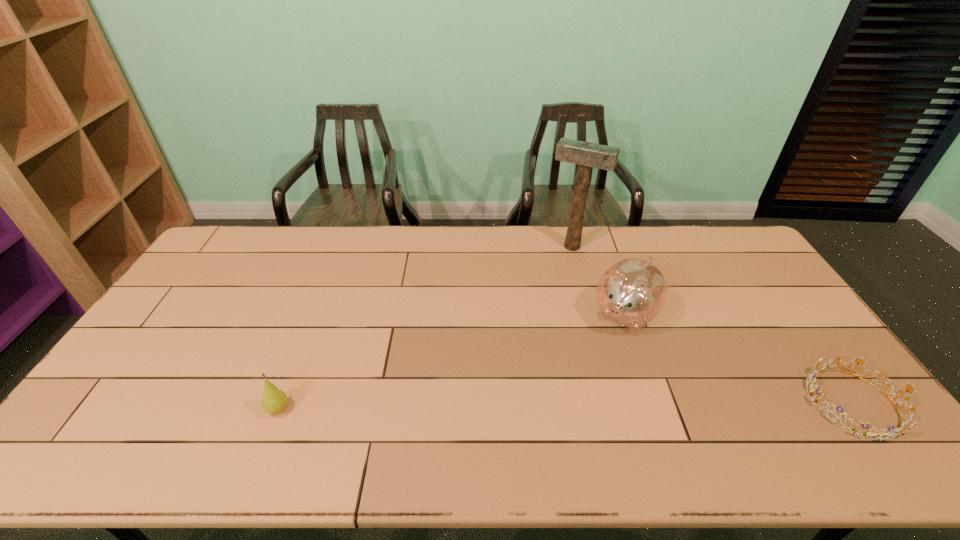
I want to click on vacant region at the far edge of the desktop, so click(x=430, y=225).

Identify the location of vacant region at the near edge. (339, 422).

This screenshot has height=540, width=960. In the image, there is a desktop. In order to click on free space at the left edge in this screenshot , I will do `click(149, 365)`.

The image size is (960, 540). Find the location of `free space at the right edge`. free space at the right edge is located at coordinates (722, 280).

I want to click on vacant area at the far left corner of the desktop, so click(x=218, y=255).

This screenshot has width=960, height=540. Find the location of `free space between the farthest object and the piggy bank`. free space between the farthest object and the piggy bank is located at coordinates (598, 281).

Locate an element on the screen. vacant area between the pear and the farthest object is located at coordinates (425, 328).

You are a GUI agent. You are given a task and a screenshot of the screen. Output one action in this format:
    pyautogui.click(x=<x>, y=<y>)
    Task: Click on the free space between the shortest object and the piggy bank
    The width and height of the screenshot is (960, 540).
    Given the screenshot: What is the action you would take?
    pyautogui.click(x=739, y=359)

Identify the location of free space that is in between the piggy bank and the tiara. Image resolution: width=960 pixels, height=540 pixels. (739, 359).

Where is `free space that is in between the shortest object and the second shortest object`? Image resolution: width=960 pixels, height=540 pixels. free space that is in between the shortest object and the second shortest object is located at coordinates (565, 406).